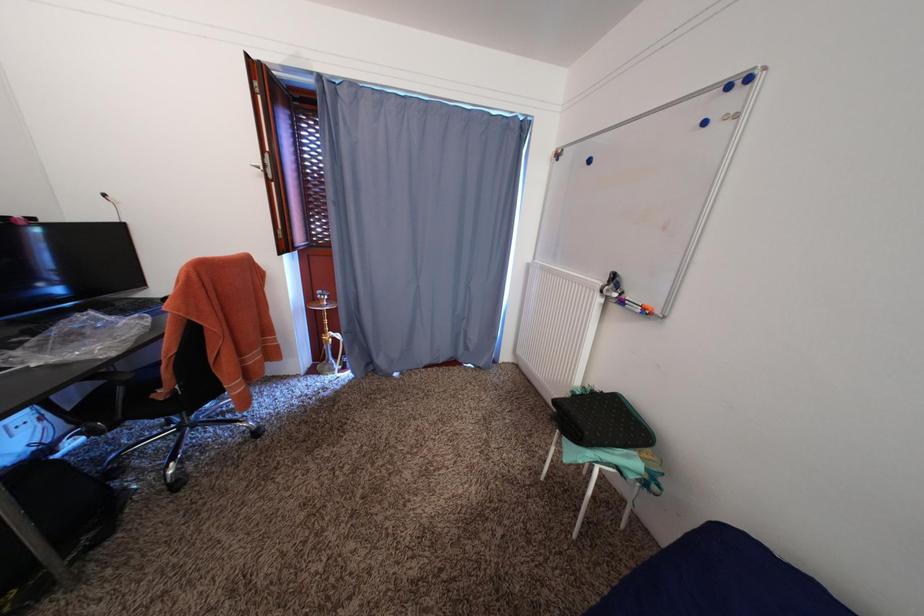
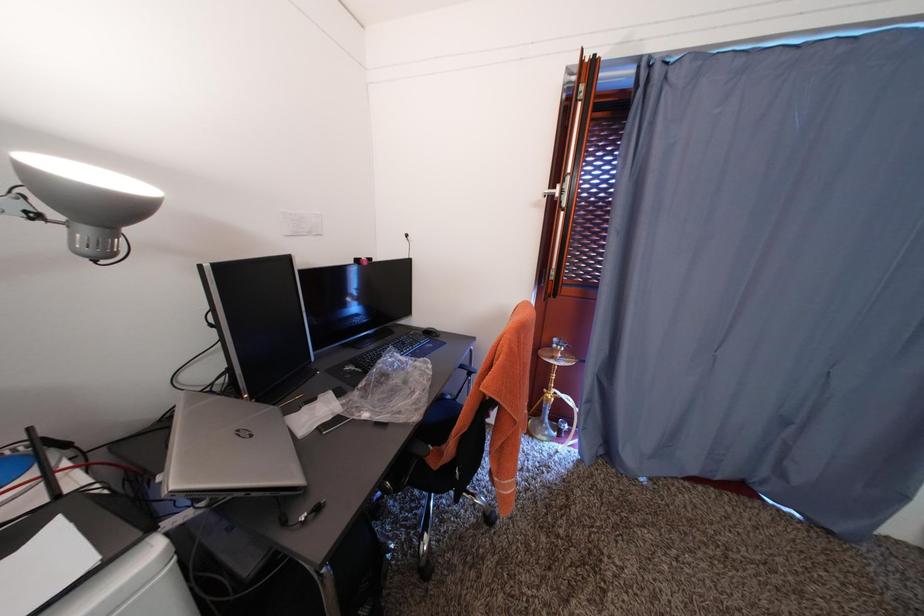
Question: The camera is either moving clockwise (left) or counter-clockwise (right) around the object. The first image is from the beginning of the video and the second image is from the end. Is the camera moving left or right when shooting the video?

Choices:
 (A) Left
 (B) Right

Answer: (B)